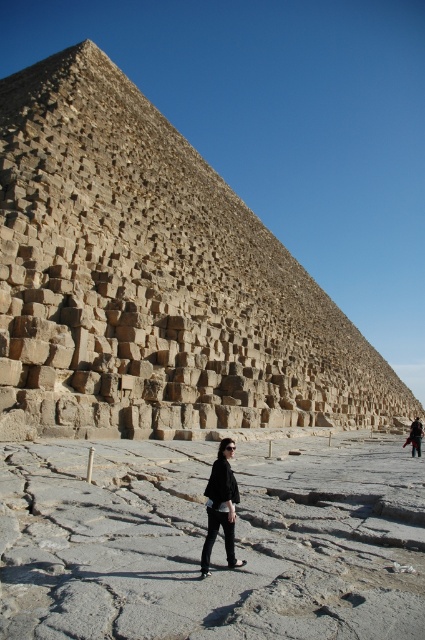
You are a tourist standing at the base of the brown stone pyramid at center and want to take a photo of the black matte jacket at center. Which object should you focus on first if you want to capture both in a single shot without moving the camera?

The brown stone pyramid at center is much taller than the black matte jacket at center, so you should focus on the brown stone pyramid at center first to ensure it is in frame before adjusting for the smaller jacket.

You are a tour guide leading a group near the brown stone pyramid at center and the black matte jacket at center. You want to emphasize the pyramid size to your group. Which object is wider?

The brown stone pyramid at center is wider than the black matte jacket at center, as its width surpasses that of the jacket.